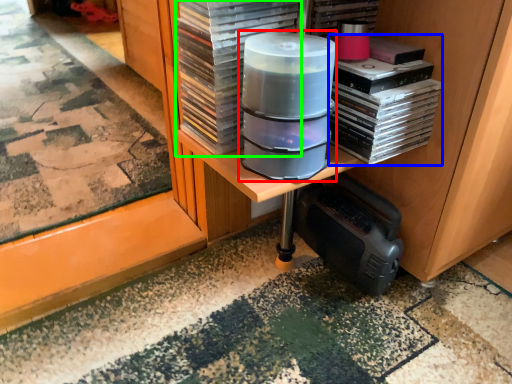
Question: Which object is the closest to the appliance (highlighted by a red box)? Choose among these: book (highlighted by a blue box) or paperback book (highlighted by a green box).

Choices:
 (A) book
 (B) paperback book

Answer: (B)